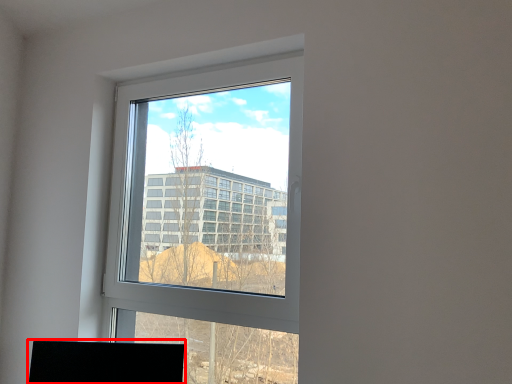
Question: From the image's perspective, what is the correct spatial positioning of desktop (annotated by the red box) in reference to window?

Choices:
 (A) below
 (B) above

Answer: (A)